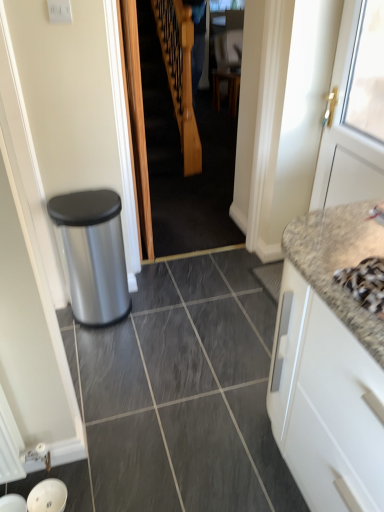
In order to face wooden staircase at center, should I rotate leftwards or rightwards?

Rotate your view right by about 0.942°.

Locate an element on the screen. The image size is (384, 512). white matte cabinet at right is located at coordinates (329, 364).

What is the approximate width of white matte cabinet at right?

It is 20.90 inches.

The image size is (384, 512). Describe the element at coordinates (180, 395) in the screenshot. I see `granite at right` at that location.

In order to face granite at right, should I rotate leftwards or rightwards?

To face it directly, rotate left by 0.073 degrees.

Locate an element on the screen. This screenshot has width=384, height=512. wooden staircase at center is located at coordinates (182, 159).

Choose the correct answer: Is white matte cabinet at right inside blue fabric at center or outside it?

white matte cabinet at right is spatially situated outside blue fabric at center.

Is white matte cabinet at right looking in the opposite direction of blue fabric at center?

No, blue fabric at center is not at the back of white matte cabinet at right.

From a real-world perspective, is white matte cabinet at right above or below blue fabric at center?

In terms of real-world spatial position, white matte cabinet at right is below blue fabric at center.

Is white matte cabinet at right smaller than blue fabric at center?

Actually, white matte cabinet at right might be larger than blue fabric at center.

From the image's perspective, is wooden staircase at center beneath white matte cabinet at right?

No, from the image's perspective, wooden staircase at center is not beneath white matte cabinet at right.

The width and height of the screenshot is (384, 512). I want to click on stairwell behind the white matte cabinet at right, so (x=182, y=159).

Is wooden staircase at center facing towards white matte cabinet at right?

Yes, wooden staircase at center is oriented towards white matte cabinet at right.

Would you consider wooden staircase at center to be distant from white matte cabinet at right?

Indeed, wooden staircase at center is not near white matte cabinet at right.

Based on the photo, can you tell me how much granite at right and silver metallic faucet at upper right differ in facing direction?

90.7 degrees.

Is granite at right oriented away from silver metallic faucet at upper right?

That's not correct — granite at right is not looking away from silver metallic faucet at upper right.

From a real-world perspective, who is located higher, granite at right or silver metallic faucet at upper right?

silver metallic faucet at upper right, from a real-world perspective.

Measure the distance from granite at right to silver metallic faucet at upper right.

They are 3.76 feet apart.

Where is `faucet that appears in front of the wooden staircase at center`? The image size is (384, 512). faucet that appears in front of the wooden staircase at center is located at coordinates (377, 214).

From the picture: Is there a large distance between wooden staircase at center and silver metallic faucet at upper right?

That's right, there is a large distance between wooden staircase at center and silver metallic faucet at upper right.

Which object is positioned more to the left, wooden staircase at center or silver metallic faucet at upper right?

wooden staircase at center is more to the left.

Is silver metallic faucet at upper right located within wooden staircase at center?

No.

From a real-world perspective, is wooden staircase at center physically above white painted wood door at right?

No, from a real-world perspective, wooden staircase at center is not on top of white painted wood door at right.

How much distance is there between wooden staircase at center and white painted wood door at right?

wooden staircase at center is 4.53 feet from white painted wood door at right.

Between wooden staircase at center and white painted wood door at right, which one has smaller width?

white painted wood door at right.

From the image's perspective, is wooden staircase at center located above or below white painted wood door at right?

wooden staircase at center is above white painted wood door at right.

Is white matte cabinet at right wider than silver metallic faucet at upper right?

Yes.

Are white matte cabinet at right and silver metallic faucet at upper right far apart?

No, white matte cabinet at right is not far away from silver metallic faucet at upper right.

Is silver metallic faucet at upper right inside white matte cabinet at right?

Yes, silver metallic faucet at upper right is a part of white matte cabinet at right.

Which of these two, white matte cabinet at right or silver metallic faucet at upper right, stands taller?

With more height is white matte cabinet at right.

Are blue fabric at center and white matte cabinet at right far apart?

That's right, there is a large distance between blue fabric at center and white matte cabinet at right.

From a real-world perspective, is blue fabric at center physically located above or below white matte cabinet at right?

Clearly, from a real-world perspective, blue fabric at center is above white matte cabinet at right.

Which of these two, blue fabric at center or white matte cabinet at right, stands shorter?

white matte cabinet at right.

From the image's perspective, relative to white matte cabinet at right, is blue fabric at center above or below?

Based on their image positions, blue fabric at center is located above white matte cabinet at right.

I want to click on couple on the left of white matte cabinet at right, so click(x=197, y=41).

Locate an element on the screen. The height and width of the screenshot is (512, 384). cabinetry on the right of wooden staircase at center is located at coordinates (329, 364).

Estimate the real-world distances between objects in this image. Which object is further from granite at right, white painted wood door at right or blue fabric at center?

blue fabric at center lies further to granite at right than the other object.

Which object lies nearer to the anchor point white matte cabinet at right, blue fabric at center or white painted wood door at right?

Among the two, white painted wood door at right is located nearer to white matte cabinet at right.

From the image, which object appears to be nearer to blue fabric at center, granite at right or white matte cabinet at right?

Among the two, granite at right is located nearer to blue fabric at center.

Looking at the image, which one is located closer to white matte cabinet at right, white painted wood door at right or wooden staircase at center?

Among the two, white painted wood door at right is located nearer to white matte cabinet at right.

Based on their spatial positions, is blue fabric at center or granite at right further from silver metallic faucet at upper right?

blue fabric at center is positioned further to the anchor silver metallic faucet at upper right.

From the image, which object appears to be nearer to granite at right, white painted wood door at right or silver metallic faucet at upper right?

silver metallic faucet at upper right lies closer to granite at right than the other object.

From the image, which object appears to be nearer to blue fabric at center, white painted wood door at right or wooden staircase at center?

The object closer to blue fabric at center is wooden staircase at center.

From the image, which object appears to be farther from wooden staircase at center, blue fabric at center or granite at right?

blue fabric at center.

Locate an element on the screen. The height and width of the screenshot is (512, 384). faucet between white matte cabinet at right and wooden staircase at center along the z-axis is located at coordinates (377, 214).

The width and height of the screenshot is (384, 512). Identify the location of faucet between white painted wood door at right and granite at right from top to bottom. (377, 214).

Locate an element on the screen. Image resolution: width=384 pixels, height=512 pixels. stairwell located between silver metallic faucet at upper right and blue fabric at center in the depth direction is located at coordinates (182, 159).

Image resolution: width=384 pixels, height=512 pixels. I want to click on door between white matte cabinet at right and blue fabric at center along the z-axis, so click(347, 136).